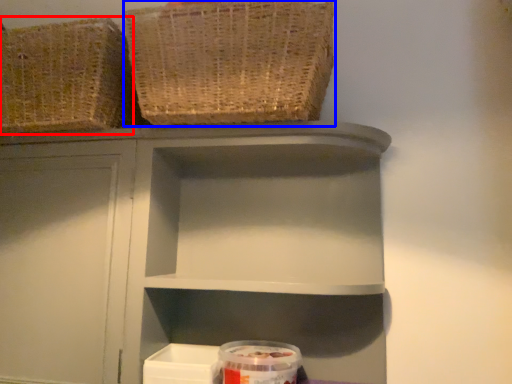
Question: Among these objects, which one is nearest to the camera, basket (highlighted by a red box) or basket (highlighted by a blue box)?

Choices:
 (A) basket
 (B) basket

Answer: (B)